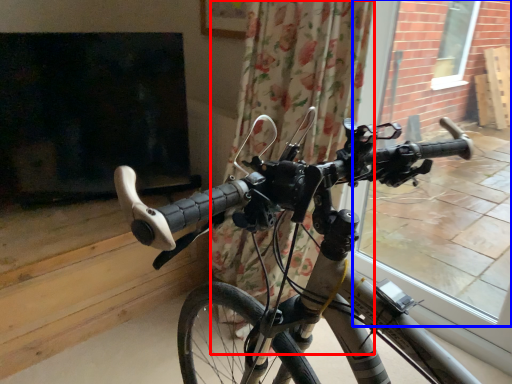
Question: Which of the following is the farthest to the observer, curtain (highlighted by a red box) or window frame (highlighted by a blue box)?

Choices:
 (A) curtain
 (B) window frame

Answer: (B)